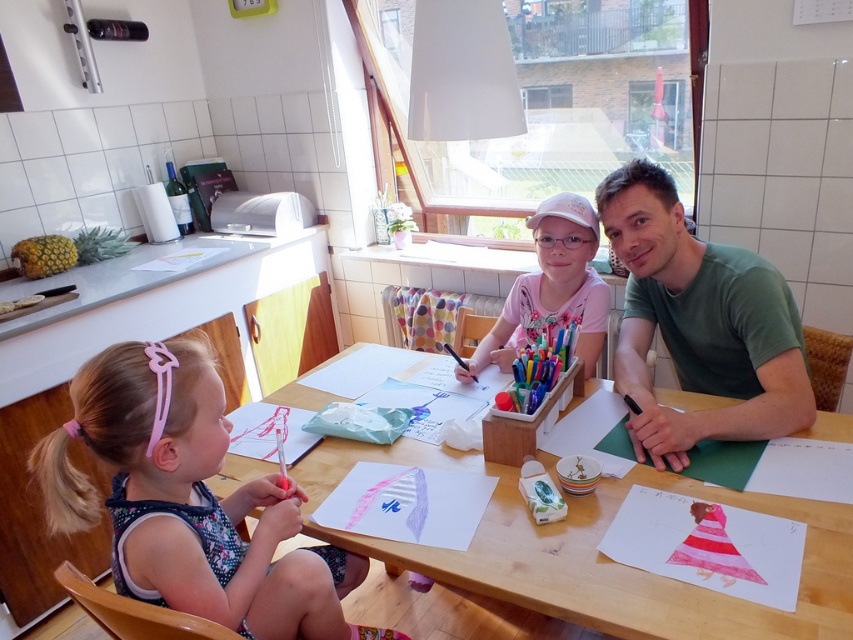
You are organizing a clothing donation drive and need to determine which shirt is taller between the green cotton shirt at upper right and the pink fabric shirt at center. Based on the scene, which one should you list as taller?

The green cotton shirt at upper right has a greater height compared to the pink fabric shirt at center, so you should list the green cotton shirt at upper right as taller.

You are a delivery robot that is 10 inches wide. You need to move from the entrance to the kitchen to the wooden table at center. There is a floral dress at lower left in the way. Can you pass between them without hitting anything?

The distance between the floral dress at lower left and wooden table at center is 12.26 inches. Since the robot is 10 inches wide, it can pass through the space between them without any issues.

You are a delivery person who needs to place a small package on the wooden table at center without disturbing the pink fabric shirt at center. Can you fit the package between them if the package is 50 centimeters long?

The wooden table at center and pink fabric shirt at center are 56.38 centimeters apart from each other. Since the package is 50 centimeters long, it can fit between them as there is enough space.